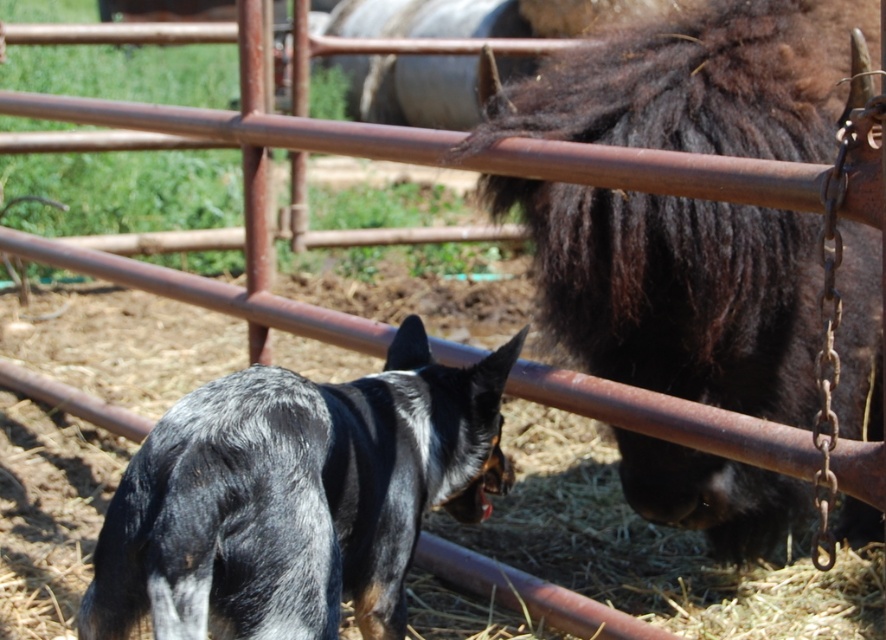
Which is more to the left, brown fuzzy yak at center or black and white fur dog at center?

From the viewer's perspective, black and white fur dog at center appears more on the left side.

Is brown fuzzy yak at center shorter than black and white fur dog at center?

No, brown fuzzy yak at center is not shorter than black and white fur dog at center.

Who is more distant from viewer, (x=834, y=104) or (x=127, y=582)?

Positioned behind is point (x=834, y=104).

Locate an element on the screen. The height and width of the screenshot is (640, 886). brown fuzzy yak at center is located at coordinates (677, 292).